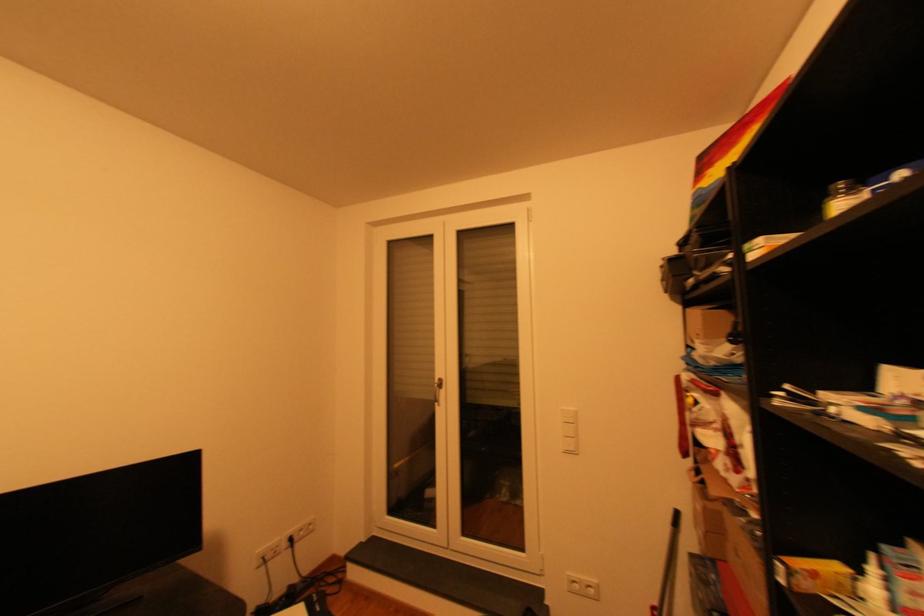
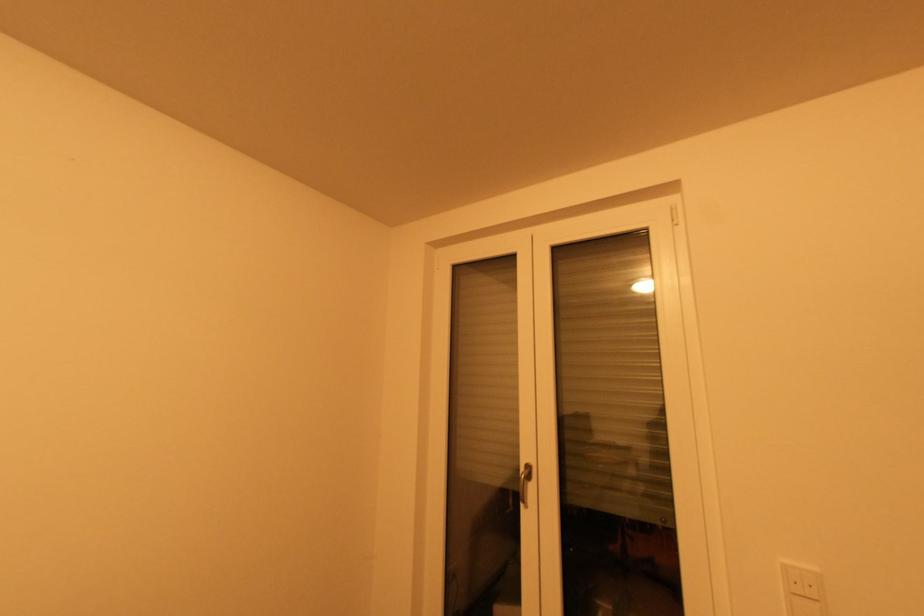
Question: The images are taken continuously from a first-person perspective. In which direction are you moving?

Choices:
 (A) Left
 (B) Right
 (C) Forward
 (D) Backward

Answer: (C)